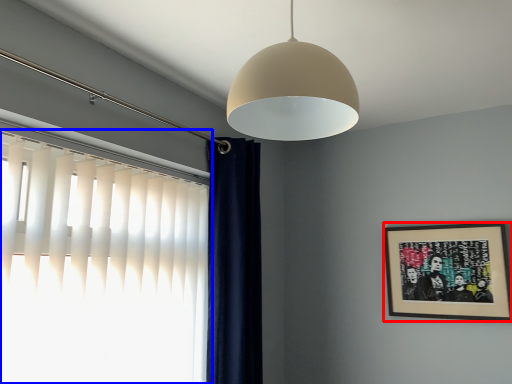
Question: Which of the following is the closest to the observer, picture frame (highlighted by a red box) or window (highlighted by a blue box)?

Choices:
 (A) picture frame
 (B) window

Answer: (B)